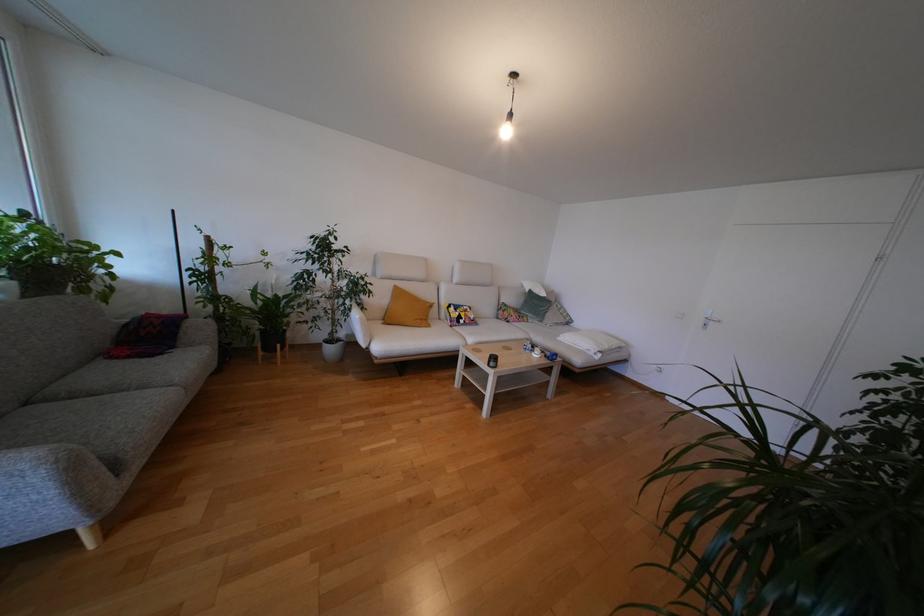
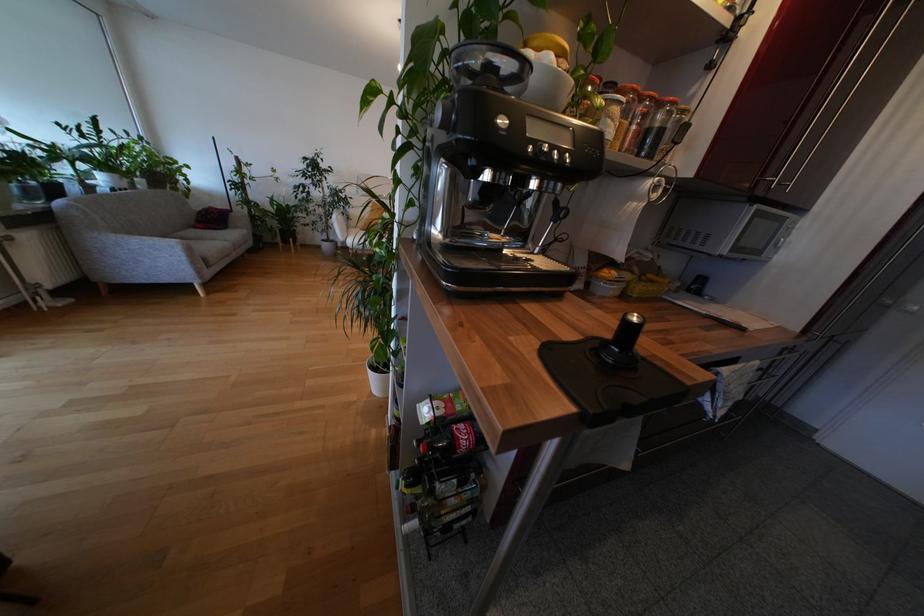
Find the pixel in the second image that matches point (115, 360) in the first image.

(200, 230)